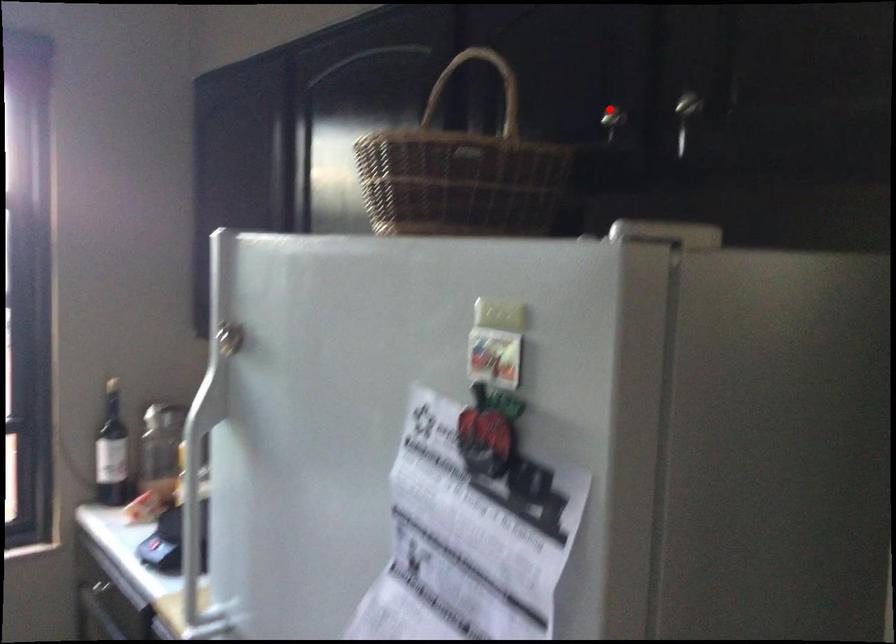
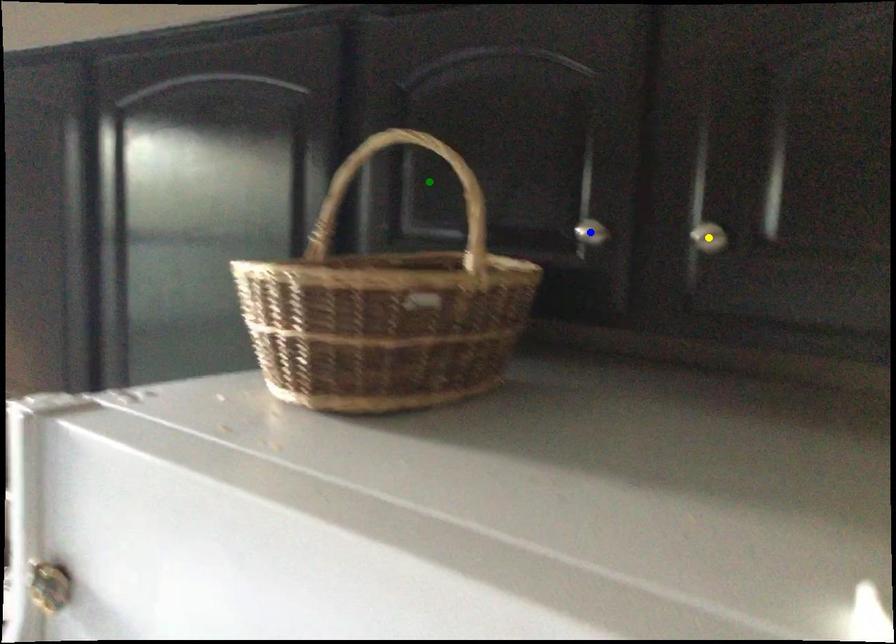
Question: I am providing you with two images of the same scene from different viewpoints. A red point is marked on the first image. You are given multiple points on the second image. Which spot in image 2 lines up with the point in image 1?

Choices:
 (A) green point
 (B) yellow point
 (C) blue point

Answer: (C)